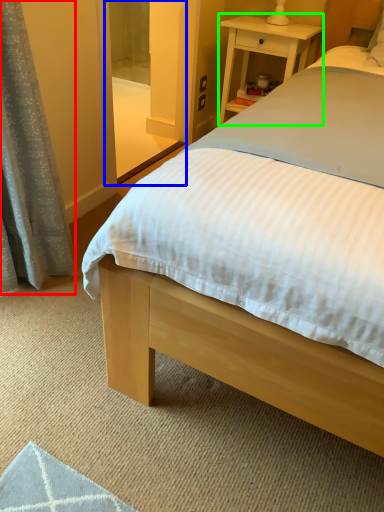
Question: Which object is the closest to the curtain (highlighted by a red box)? Choose among these: screen door (highlighted by a blue box) or nightstand (highlighted by a green box).

Choices:
 (A) screen door
 (B) nightstand

Answer: (A)